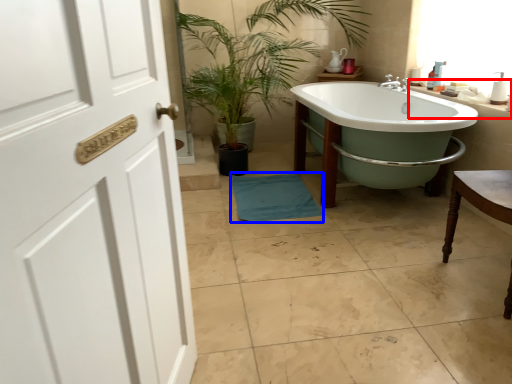
Question: Which point is further to the camera, counter top (highlighted by a red box) or bath towel (highlighted by a blue box)?

Choices:
 (A) counter top
 (B) bath towel

Answer: (B)